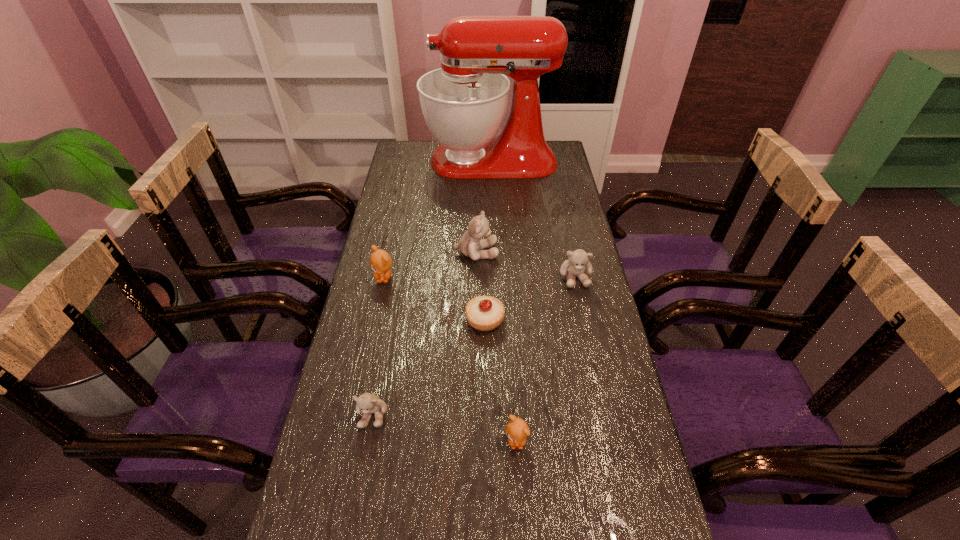
Where is `the tallest object`? the tallest object is located at coordinates (464, 102).

You are a GUI agent. You are given a task and a screenshot of the screen. Output one action in this format:
    pyautogui.click(x=<x>, y=<y>)
    Task: Click on the mixer
    
    Given the screenshot: What is the action you would take?
    pyautogui.click(x=464, y=102)

Where is `the tallest teddy bear`? Image resolution: width=960 pixels, height=540 pixels. the tallest teddy bear is located at coordinates (469, 244).

The image size is (960, 540). I want to click on the biggest gray teddy bear, so click(469, 244).

At what (x,y) coordinates should I click in order to perform the action: click on the bigger brown teddy bear. Please return your answer as a coordinate pair (x, y). This screenshot has height=540, width=960. Looking at the image, I should click on (380, 261).

Where is `the left brown teddy bear`? This screenshot has height=540, width=960. the left brown teddy bear is located at coordinates (380, 261).

Identify the location of the rightmost teddy bear. Image resolution: width=960 pixels, height=540 pixels. (578, 262).

This screenshot has height=540, width=960. I want to click on the rightmost gray teddy bear, so click(x=578, y=262).

Where is `the nearer brown teddy bear`? the nearer brown teddy bear is located at coordinates (517, 430).

Where is `the right brown teddy bear`? the right brown teddy bear is located at coordinates (517, 430).